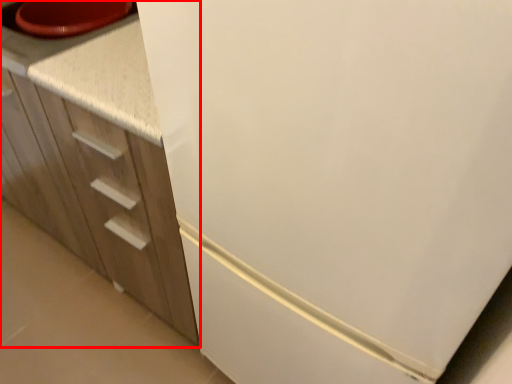
Question: From the image's perspective, what is the correct spatial relationship of cabinetry (annotated by the red box) in relation to counter top?

Choices:
 (A) above
 (B) below

Answer: (B)